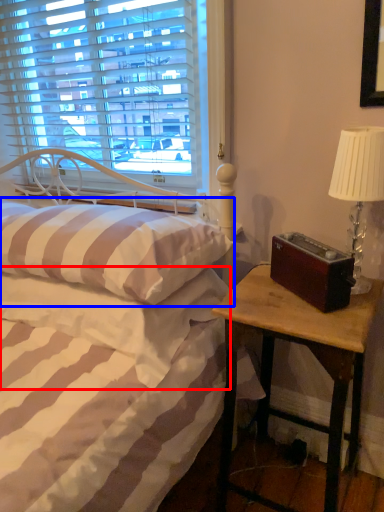
Question: Which point is further to the camera, mattress (highlighted by a red box) or pillow (highlighted by a blue box)?

Choices:
 (A) mattress
 (B) pillow

Answer: (A)